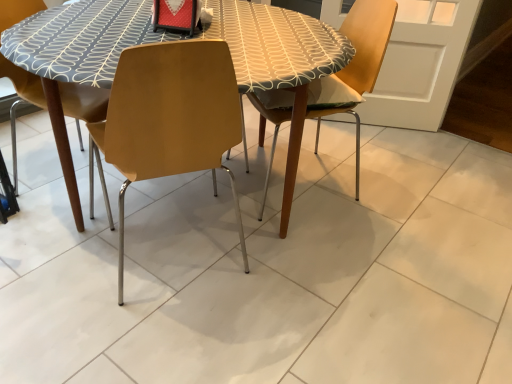
This screenshot has width=512, height=384. I want to click on matte wood chair at center, acting as the 1th chair starting from the left, so click(x=169, y=119).

Image resolution: width=512 pixels, height=384 pixels. Describe the element at coordinates (169, 119) in the screenshot. I see `matte wood chair at center, acting as the 1th chair starting from the left` at that location.

This screenshot has width=512, height=384. I want to click on wooden chair at center, the second chair in the left-to-right sequence, so click(x=354, y=67).

Describe the element at coordinates (354, 67) in the screenshot. I see `wooden chair at center, the second chair in the left-to-right sequence` at that location.

I want to click on matte wood chair at center, acting as the 1th chair starting from the left, so click(x=169, y=119).

Which is more to the left, wooden chair at center, placed as the 1th chair when sorted from right to left, or matte wood chair at center, the 2th chair from the right?

From the viewer's perspective, matte wood chair at center, the 2th chair from the right, appears more on the left side.

Considering the positions of objects wooden chair at center, placed as the 1th chair when sorted from right to left, and matte wood chair at center, acting as the 1th chair starting from the left, in the image provided, who is behind, wooden chair at center, placed as the 1th chair when sorted from right to left, or matte wood chair at center, acting as the 1th chair starting from the left,?

Positioned behind is wooden chair at center, placed as the 1th chair when sorted from right to left.

Which is farther, (x=358, y=98) or (x=170, y=140)?

The point (x=358, y=98) is more distant.

From the image's perspective, is wooden chair at center, placed as the 1th chair when sorted from right to left, on matte wood chair at center, the 2th chair from the right?

Yes, from the image's perspective, wooden chair at center, placed as the 1th chair when sorted from right to left, is over matte wood chair at center, the 2th chair from the right.

From a real-world perspective, is wooden chair at center, placed as the 1th chair when sorted from right to left, beneath matte wood chair at center, the 2th chair from the right?

Yes, from a real-world perspective, wooden chair at center, placed as the 1th chair when sorted from right to left, is below matte wood chair at center, the 2th chair from the right.

Which of these two, wooden chair at center, placed as the 1th chair when sorted from right to left, or matte wood chair at center, the 2th chair from the right, is wider?

With larger width is wooden chair at center, placed as the 1th chair when sorted from right to left.

Can you confirm if wooden chair at center, placed as the 1th chair when sorted from right to left, is shorter than matte wood chair at center, the 2th chair from the right?

Yes.

Between wooden chair at center, placed as the 1th chair when sorted from right to left, and matte wood chair at center, acting as the 1th chair starting from the left, which one has smaller size?

matte wood chair at center, acting as the 1th chair starting from the left, is smaller.

Would you say matte wood chair at center, the 2th chair from the right, is part of wooden chair at center, placed as the 1th chair when sorted from right to left,'s contents?

No.

Are wooden chair at center, placed as the 1th chair when sorted from right to left, and matte wood chair at center, the 2th chair from the right, beside each other?

They are not placed beside each other.

Could you tell me if wooden chair at center, placed as the 1th chair when sorted from right to left, is turned towards matte wood chair at center, the 2th chair from the right?

Yes, wooden chair at center, placed as the 1th chair when sorted from right to left, is turned towards matte wood chair at center, the 2th chair from the right.

I want to click on chair that appears above the wooden chair at center, placed as the 1th chair when sorted from right to left (from a real-world perspective), so click(169, 119).

Which is more to the left, matte wood chair at center, acting as the 1th chair starting from the left, or wooden chair at center, the second chair in the left-to-right sequence?

matte wood chair at center, acting as the 1th chair starting from the left.

Is matte wood chair at center, the 2th chair from the right, further to camera compared to wooden chair at center, the second chair in the left-to-right sequence?

No, the depth of matte wood chair at center, the 2th chair from the right, is less than that of wooden chair at center, the second chair in the left-to-right sequence.

Is point (89, 146) farther from viewer compared to point (383, 12)?

Yes, point (89, 146) is farther from viewer.

From the image's perspective, is matte wood chair at center, acting as the 1th chair starting from the left, below wooden chair at center, placed as the 1th chair when sorted from right to left?

Yes, from the image's perspective, matte wood chair at center, acting as the 1th chair starting from the left, is beneath wooden chair at center, placed as the 1th chair when sorted from right to left.

From a real-world perspective, is matte wood chair at center, acting as the 1th chair starting from the left, on top of wooden chair at center, placed as the 1th chair when sorted from right to left?

Yes, from a real-world perspective, matte wood chair at center, acting as the 1th chair starting from the left, is over wooden chair at center, placed as the 1th chair when sorted from right to left

Looking at their sizes, would you say matte wood chair at center, acting as the 1th chair starting from the left, is wider or thinner than wooden chair at center, placed as the 1th chair when sorted from right to left?

matte wood chair at center, acting as the 1th chair starting from the left, is thinner than wooden chair at center, placed as the 1th chair when sorted from right to left.

Between matte wood chair at center, the 2th chair from the right, and wooden chair at center, placed as the 1th chair when sorted from right to left, which one has more height?

Standing taller between the two is matte wood chair at center, the 2th chair from the right.

Considering the relative sizes of matte wood chair at center, the 2th chair from the right, and wooden chair at center, the second chair in the left-to-right sequence, in the image provided, is matte wood chair at center, the 2th chair from the right, bigger than wooden chair at center, the second chair in the left-to-right sequence,?

No.

Is wooden chair at center, placed as the 1th chair when sorted from right to left, surrounded by matte wood chair at center, the 2th chair from the right?

Definitely not — wooden chair at center, placed as the 1th chair when sorted from right to left, is not inside matte wood chair at center, the 2th chair from the right.

Is matte wood chair at center, the 2th chair from the right, touching wooden chair at center, the second chair in the left-to-right sequence?

No.

Could you tell me if matte wood chair at center, the 2th chair from the right, is turned towards wooden chair at center, placed as the 1th chair when sorted from right to left?

No, matte wood chair at center, the 2th chair from the right, is not aimed at wooden chair at center, placed as the 1th chair when sorted from right to left.

Can you tell me how much matte wood chair at center, acting as the 1th chair starting from the left, and wooden chair at center, placed as the 1th chair when sorted from right to left, differ in facing direction?

They differ by 85.2 degrees in their facing directions.

At what (x,y) coordinates should I click in order to perform the action: click on chair to the left of wooden chair at center, placed as the 1th chair when sorted from right to left. Please return your answer as a coordinate pair (x, y). The image size is (512, 384). Looking at the image, I should click on coord(169,119).

Where is `chair that appears behind the matte wood chair at center, acting as the 1th chair starting from the left`? chair that appears behind the matte wood chair at center, acting as the 1th chair starting from the left is located at coordinates (354, 67).

Locate an element on the screen. This screenshot has height=384, width=512. chair on the right of matte wood chair at center, the 2th chair from the right is located at coordinates (354, 67).